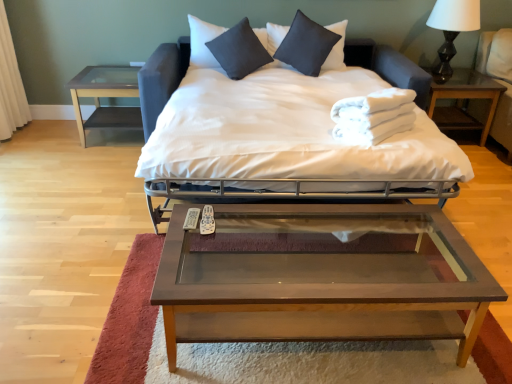
Locate an element on the screen. vacant area that lies in front of clear glass table at left, which appears as the 2th nightstand when viewed from the right is located at coordinates (92, 157).